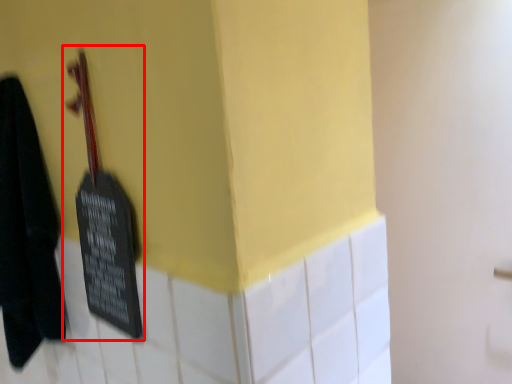
Question: From the image's perspective, where is violin (annotated by the red box) located relative to towel?

Choices:
 (A) below
 (B) above

Answer: (B)